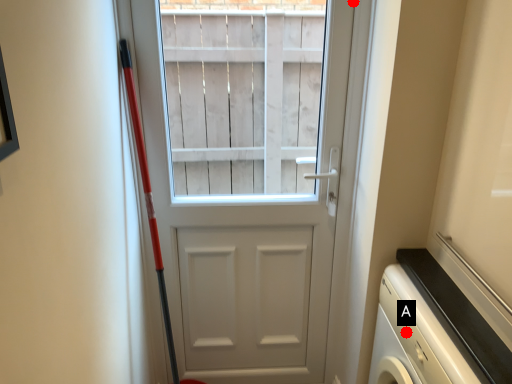
Question: Two points are circled on the image, labeled by A and B beside each circle. Among these points, which one is nearest to the camera?

Choices:
 (A) A is closer
 (B) B is closer

Answer: (A)